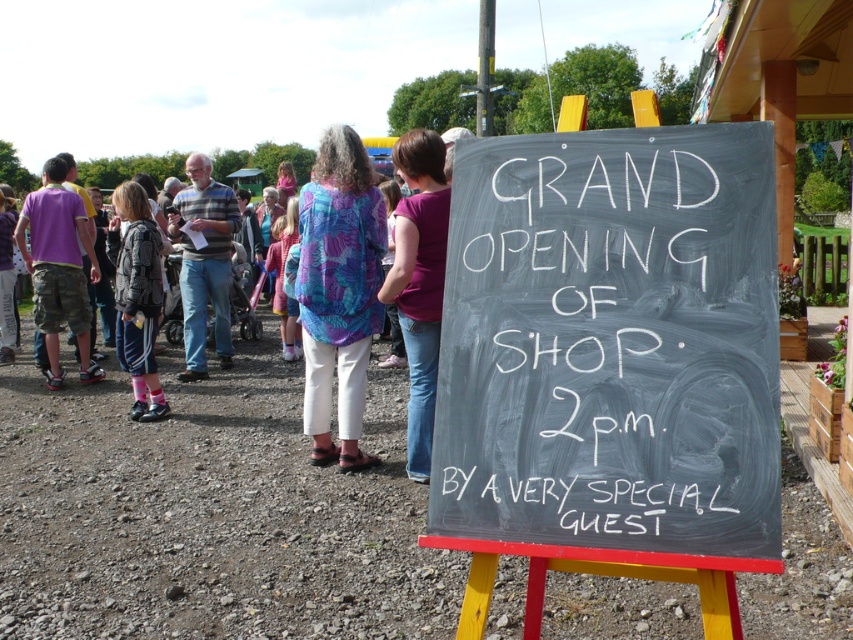
You are a photographer at the event and need to capture a photo of the camo pants at left and gray plaid shirt at left. Based on their heights, which one should you focus on first to ensure they are both in the frame?

The camo pants at left is much taller than the gray plaid shirt at left, so you should focus on the camo pants at left first to ensure both are in the frame.

You are organizing the event and need to ensure that the camo pants at left and the gray plaid shirt at left are visible in photos taken from the front of the chalkboard sign. Which object might be partially hidden if the other is positioned closer to the camera?

The camo pants at left is smaller than the gray plaid shirt at left, so if the gray plaid shirt at left is closer to the camera, it could partially obscure the camo pants at left.